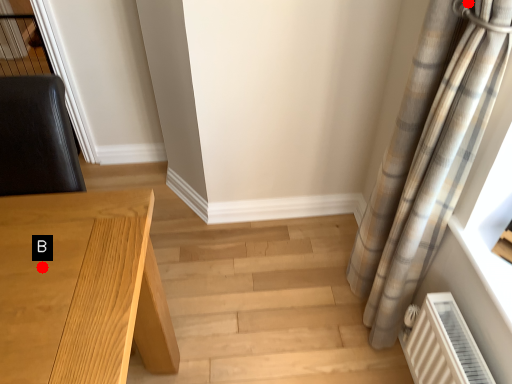
Question: Two points are circled on the image, labeled by A and B beside each circle. Which of the following is the farthest from the observer?

Choices:
 (A) A is further
 (B) B is further

Answer: (B)